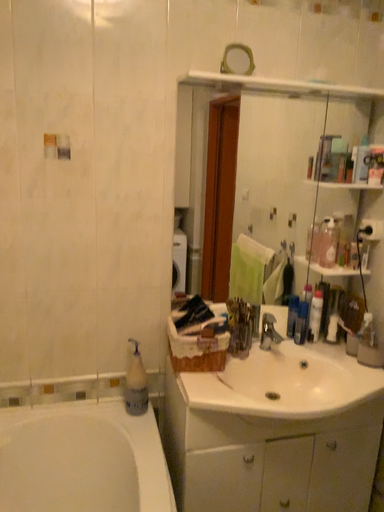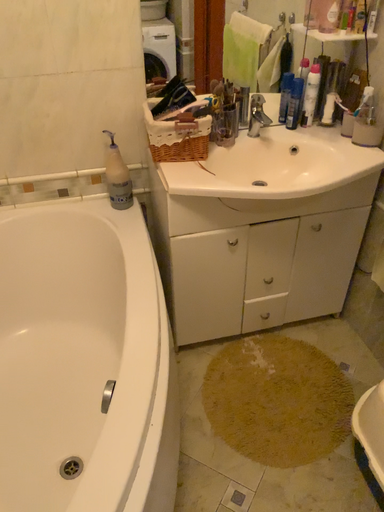
Question: How did the camera likely rotate when shooting the video?

Choices:
 (A) rotated downward
 (B) rotated upward

Answer: (A)